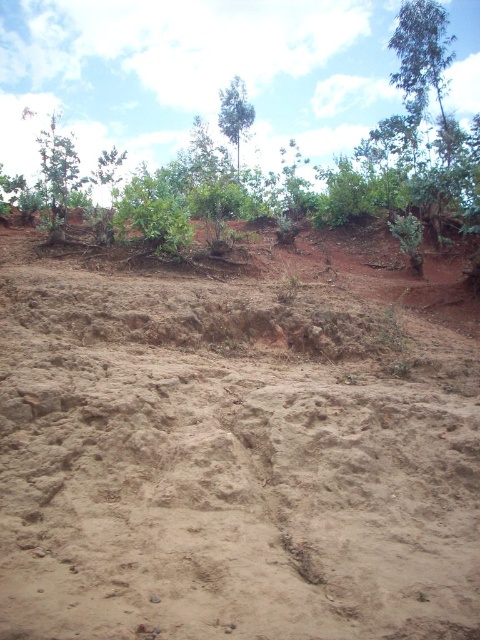
Question: Which object appears closest to the camera in this image?

Choices:
 (A) green leafy tree at upper center
 (B) green leafy tree at left

Answer: (B)

Question: Does green leafy tree at upper right have a larger size compared to green leafy tree at left?

Choices:
 (A) no
 (B) yes

Answer: (A)

Question: Which object appears closest to the camera in this image?

Choices:
 (A) green leafy tree at upper center
 (B) brown sandy dirt field at center
 (C) green leafy tree at left

Answer: (B)

Question: Which object is farther from the camera taking this photo?

Choices:
 (A) green leafy tree at upper center
 (B) green leafy tree at upper right
 (C) brown sandy dirt field at center
 (D) green leafy tree at left

Answer: (A)

Question: Is green leafy tree at left behind green leafy tree at upper center?

Choices:
 (A) yes
 (B) no

Answer: (B)

Question: From the image, what is the correct spatial relationship of green leafy tree at upper right in relation to green leafy tree at upper center?

Choices:
 (A) below
 (B) above

Answer: (A)